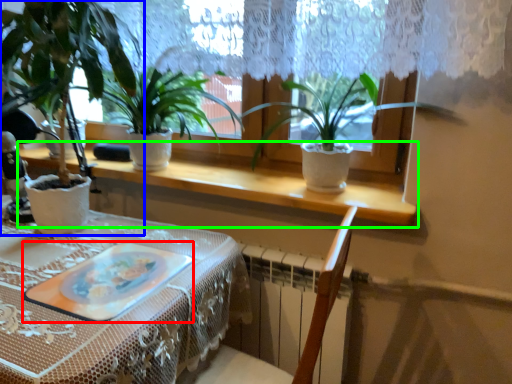
Question: Based on their relative distances, which object is farther from platter (highlighted by a red box)? Choose from houseplant (highlighted by a blue box) and window sill (highlighted by a green box).

Choices:
 (A) houseplant
 (B) window sill

Answer: (A)